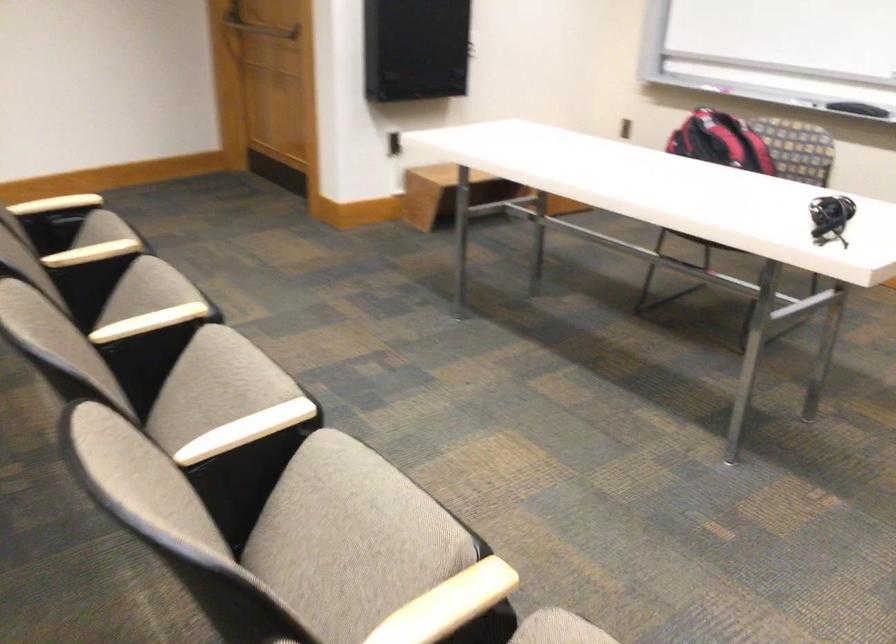
You are a GUI agent. You are given a task and a screenshot of the screen. Output one action in this format:
    pyautogui.click(x=<x>, y=<y>)
    Task: Click on the door push bar
    This screenshot has width=896, height=644.
    Given the screenshot: What is the action you would take?
    pyautogui.click(x=261, y=29)